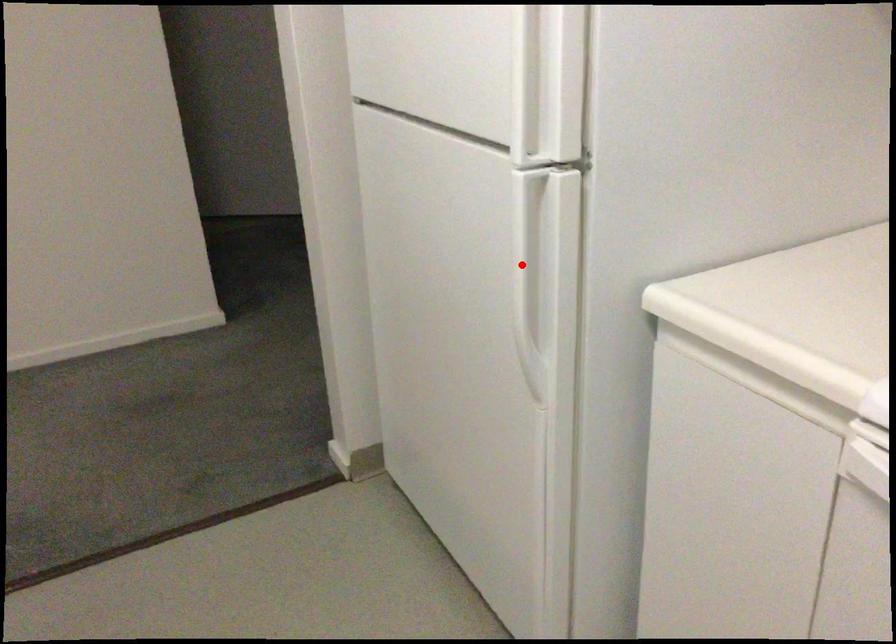
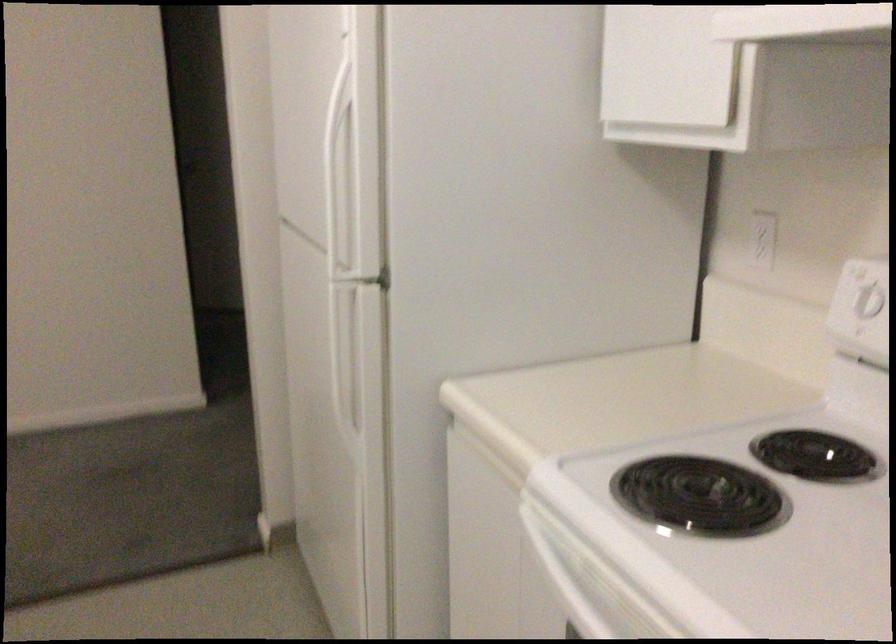
Find the pixel in the second image that matches the highlighted location in the first image.

(349, 361)